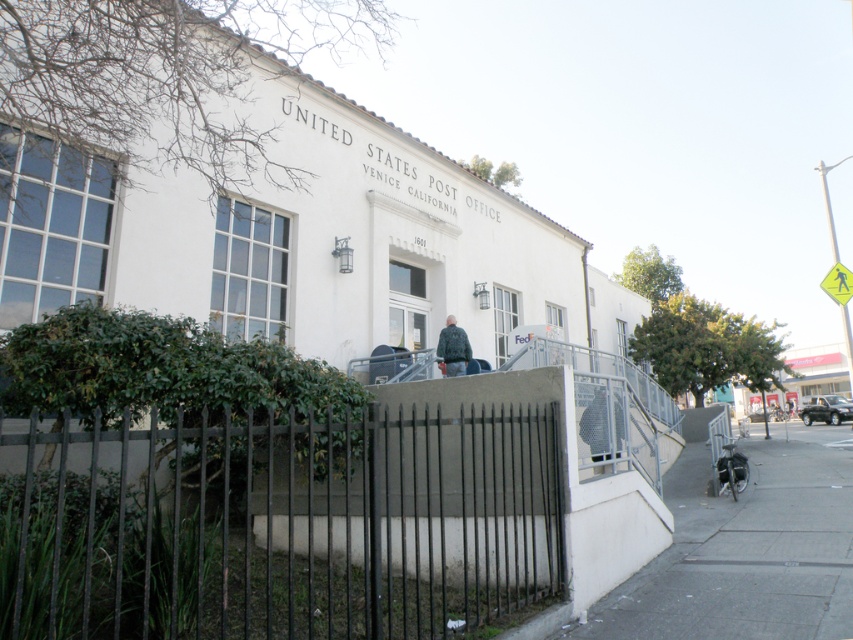
You are a pedestrian approaching the Venice, California Post Office. You see a black metal fence at lower center and a yellow reflective plastic pedestrian crossing sign at upper right. Which object is closer to the left side of the path leading to the post office entrance?

The black metal fence at lower center is closer to the left side of the path leading to the post office entrance because it is positioned to the left of the yellow reflective plastic pedestrian crossing sign at upper right.

You are standing at the entrance of the United States Post Office in Venice, California. You notice a gray concrete sidewalk at lower right and a leather jacket at center. Which object is closer to the entrance?

The leather jacket at center is closer to the entrance because the gray concrete sidewalk at lower right is positioned under it, indicating it is further away.